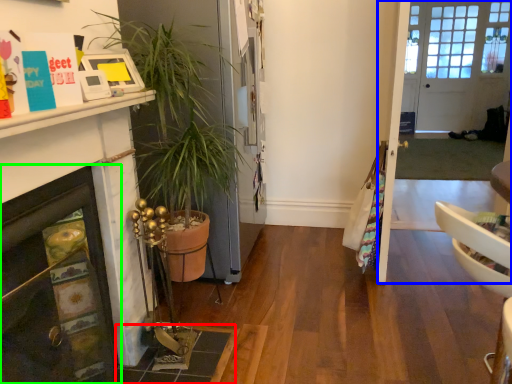
Question: Considering the real-world distances, which object is farthest from tile (highlighted by a red box)? glass door (highlighted by a blue box) or fireplace (highlighted by a green box)?

Choices:
 (A) glass door
 (B) fireplace

Answer: (A)